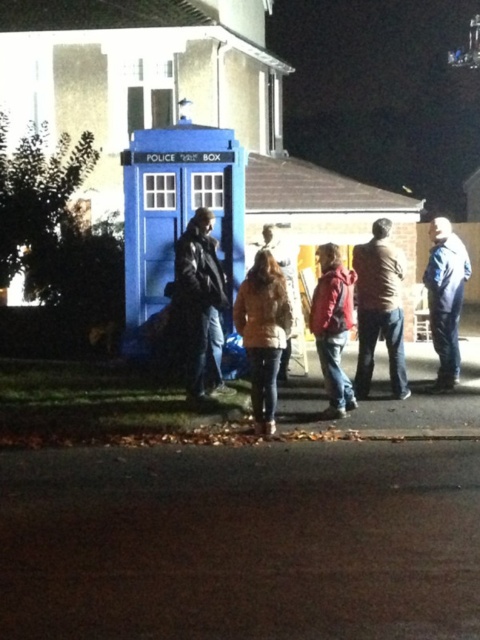
Question: Can you confirm if metallic blue police box at center is smaller than blue fabric jacket at right?

Choices:
 (A) no
 (B) yes

Answer: (A)

Question: Considering the relative positions of metallic blue police box at center and leather jacket at center in the image provided, where is metallic blue police box at center located with respect to leather jacket at center?

Choices:
 (A) above
 (B) below

Answer: (A)

Question: Which point is farther from the camera taking this photo?

Choices:
 (A) (178, 298)
 (B) (327, 260)
 (C) (457, 253)

Answer: (C)

Question: Is metallic blue police box at center above leather jacket at center?

Choices:
 (A) no
 (B) yes

Answer: (B)

Question: Which object is closer to the camera taking this photo?

Choices:
 (A) red leather jacket at center
 (B) leather jacket at center

Answer: (A)

Question: Which point appears farthest from the camera in this image?

Choices:
 (A) (187, 125)
 (B) (256, 410)
 (C) (345, 410)
 (D) (193, 284)

Answer: (A)